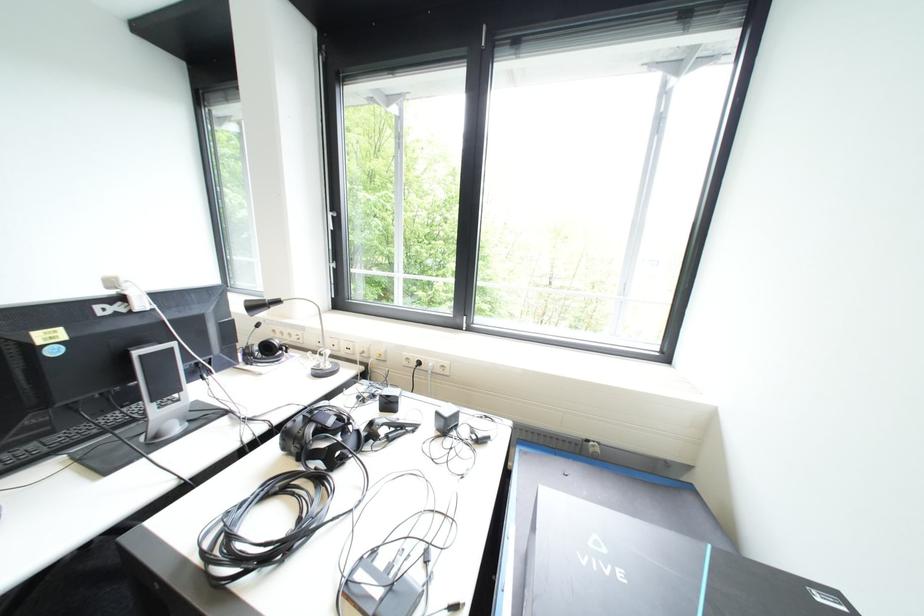
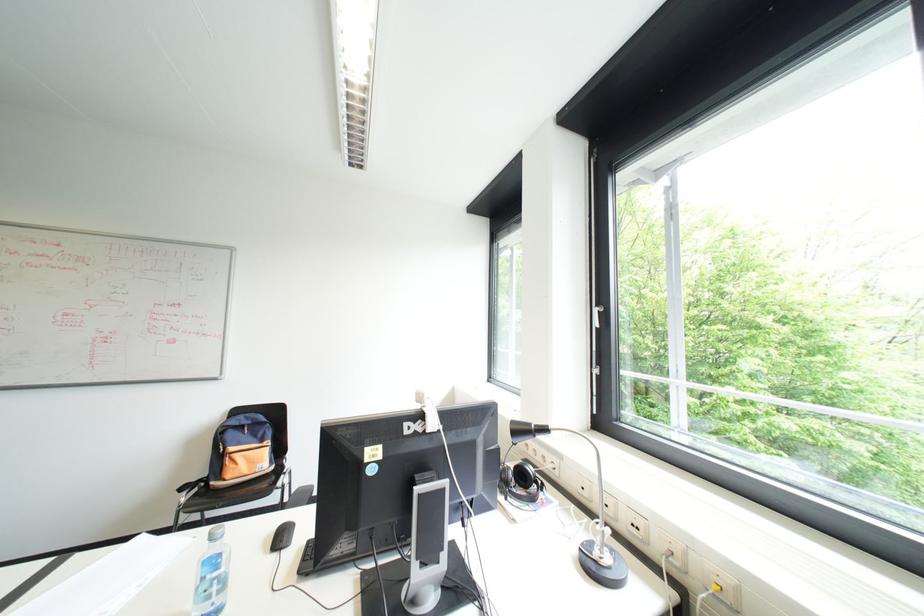
In the second image, find the point that corresponds to point 356,347 in the first image.

(640, 524)